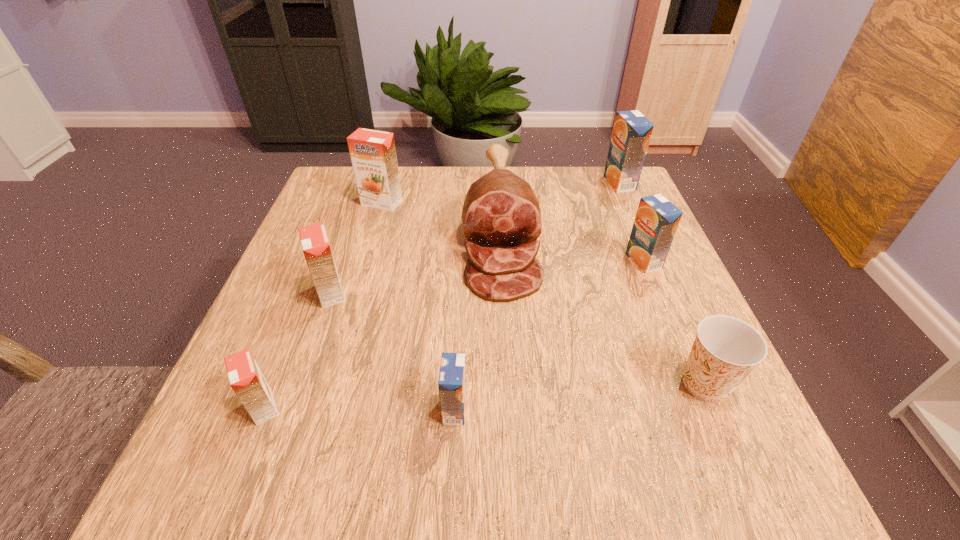
I want to click on the smallest orange orange juice, so click(x=246, y=379).

The image size is (960, 540). Find the location of `the smallest blue orange_juice`. the smallest blue orange_juice is located at coordinates (452, 377).

What are the coordinates of `the leftmost blue orange_juice` in the screenshot? It's located at (452, 377).

Find the location of a particular element. vacant region located 0.260m on the left of the farthest orange_juice is located at coordinates (510, 183).

The width and height of the screenshot is (960, 540). I want to click on free location located on the right of the farthest orange orange juice, so click(x=477, y=202).

This screenshot has height=540, width=960. What are the coordinates of `vacant space located at the sliced end of the ham` in the screenshot? It's located at (510, 420).

This screenshot has width=960, height=540. In order to click on vacant region located 0.280m on the front of the second biggest orange orange juice in this screenshot , I will do `click(277, 448)`.

At what (x,y) coordinates should I click in order to perform the action: click on vacant space located on the front of the fourth nearest orange_juice. Please return your answer as a coordinate pair (x, y). The width and height of the screenshot is (960, 540). Looking at the image, I should click on [668, 321].

The image size is (960, 540). In order to click on vacant space located 0.290m on the back of the orange Dixie cup in this screenshot , I will do `click(648, 252)`.

Locate an element on the screen. This screenshot has width=960, height=540. free space located on the back of the smallest orange orange juice is located at coordinates (327, 249).